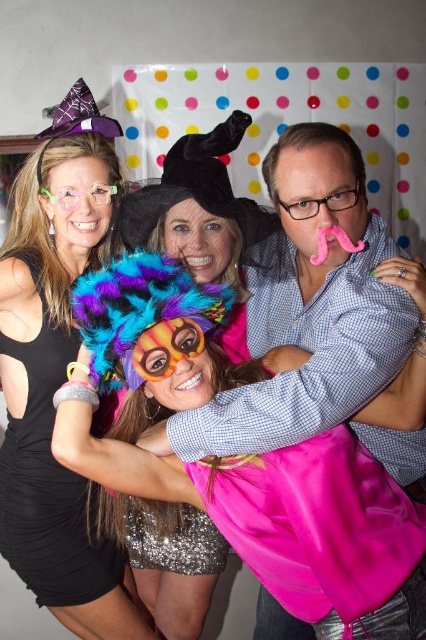
You are a photographer adjusting the camera height to capture both the fuzzy multicolored wig at center and the black satin dress at left in the same frame. Which object should you focus on first to ensure both are in focus?

The fuzzy multicolored wig at center is not as tall as the black satin dress at left, so you should focus on the black satin dress at left first to ensure both are in focus.

You are standing in front of the photo booth backdrop and want to place a sticker exactly halfway between point A at point (203, 268) and point B at point (48, 582). However, you must ensure that the sticker is placed closer to the viewer than both points. Is this possible? Explain why or why not.

No, it is not possible to place the sticker closer to the viewer than both points because the halfway point between them would be equidistant to both points, but since point A is already further away than point B, the midpoint would be between their distances. However, the requirement to be closer than both points cannot be met because the midpoint cannot be closer than the closer point B.